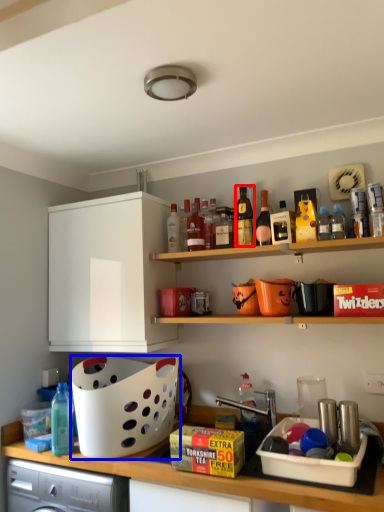
Question: Which object appears closest to the camera in this image, bottle (highlighted by a red box) or basket (highlighted by a blue box)?

Choices:
 (A) bottle
 (B) basket

Answer: (B)